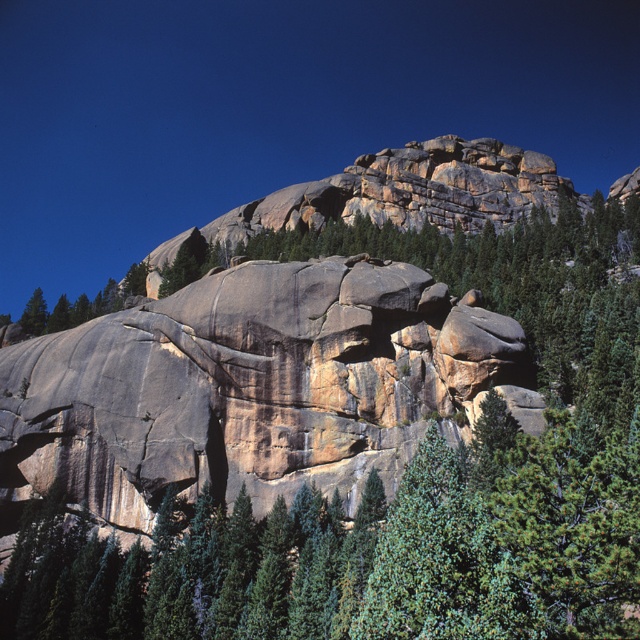
Question: Which object appears farthest from the camera in this image?

Choices:
 (A) gray granite rock face at center
 (B) rough granite rock at center

Answer: (B)

Question: Can you confirm if rough granite rock at center is thinner than gray granite rock face at center?

Choices:
 (A) no
 (B) yes

Answer: (A)

Question: Where is rough granite rock at center located in relation to gray granite rock face at center in the image?

Choices:
 (A) left
 (B) right

Answer: (B)

Question: Where is rough granite rock at center located in relation to gray granite rock face at center in the image?

Choices:
 (A) left
 (B) right

Answer: (B)

Question: Which of the following is the closest to the observer?

Choices:
 (A) (554, 83)
 (B) (182, 310)

Answer: (B)